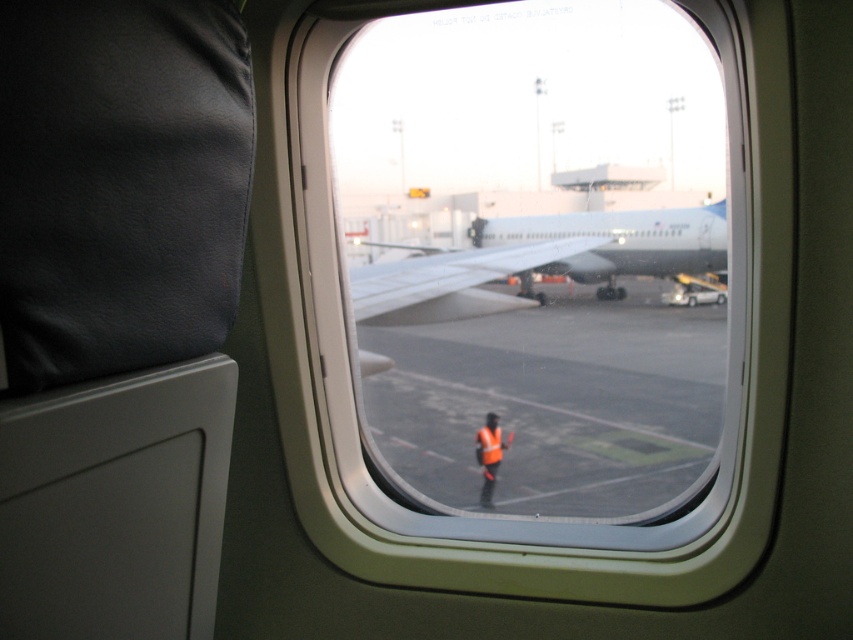
You are a passenger sitting in the airplane seat. You want to know if the transparent glass airplane window at center is taller than the reflective orange safety vest at center. Can you confirm this using the scene description?

The transparent glass airplane window at center has a greater height compared to the reflective orange safety vest at center, so yes, the window is taller than the vest.

You are a flight attendant who needs to reach the white matte airplane at center from your current position near the transparent glass airplane window at center. Can you walk directly to it without any obstacles in between?

The transparent glass airplane window at center and the white matte airplane at center are 1.36 meters apart from each other. Since there are no mentioned obstacles between them, you can walk directly to it.